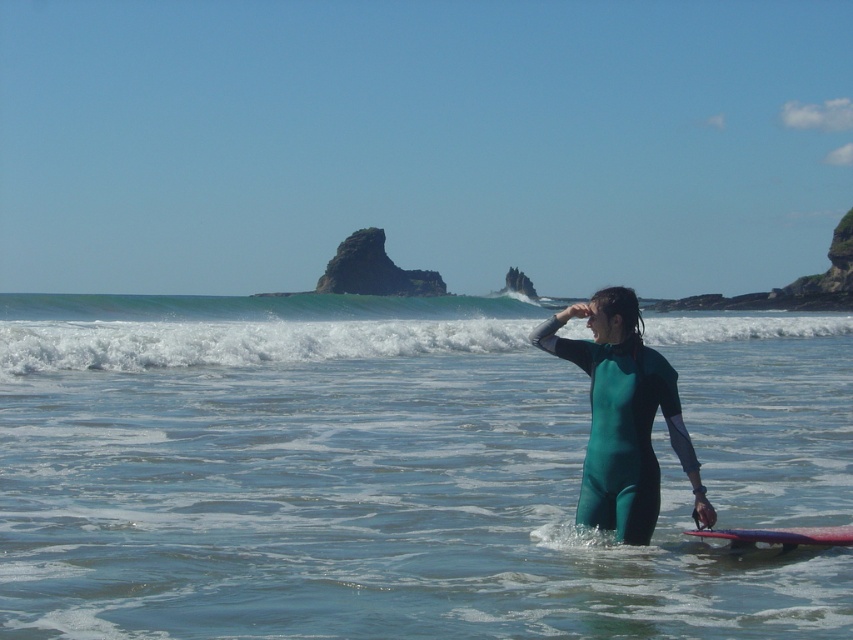
You are a photographer wanting to capture the rough granite rock at center and smooth purple surfboard at center in the same frame. Which object should you focus on first if you want to ensure both are in focus?

The rough granite rock at center is much taller than the smooth purple surfboard at center, so focusing on the taller object first would help ensure both are in focus.

You are a lifeguard observing the beach scene. There are two people in the water wearing wetsuits. One is wearing a green rubber wetsuit at center and the other a green matte wetsuit at center. Which wetsuit is taller?

The green rubber wetsuit at center is taller than the green matte wetsuit at center.